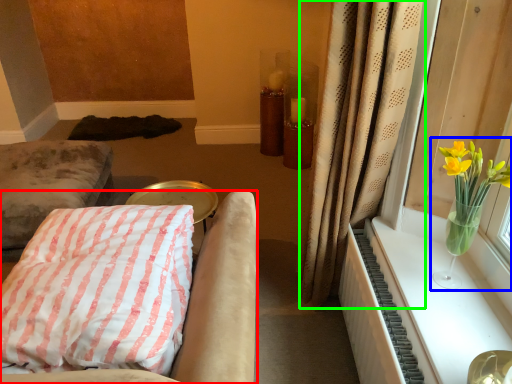
Question: Which object is positioned closest to furniture (highlighted by a red box)? Select from floral arrangement (highlighted by a blue box) and curtain (highlighted by a green box).

Choices:
 (A) floral arrangement
 (B) curtain

Answer: (B)